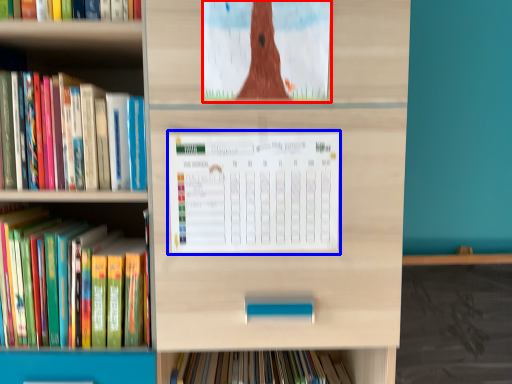
Question: Among these objects, which one is farthest to the camera, book cover (highlighted by a red box) or paperback book (highlighted by a blue box)?

Choices:
 (A) book cover
 (B) paperback book

Answer: (B)